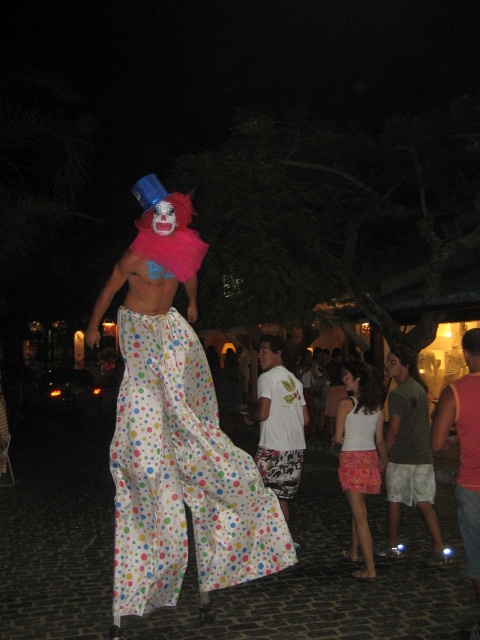
Question: Estimate the real-world distances between objects in this image. Which object is farther from the white printed t-shirt at center?

Choices:
 (A) white polka dot pants at center
 (B) pink fabric skirt at lower center
 (C) white tank top at center
 (D) polka dot fabric pants at center

Answer: (A)

Question: Does polka dot fabric pants at center come in front of white printed t-shirt at center?

Choices:
 (A) yes
 (B) no

Answer: (A)

Question: Can you confirm if white tank top at center is positioned above white polka dot pants at center?

Choices:
 (A) yes
 (B) no

Answer: (B)

Question: Which point is closer to the camera?

Choices:
 (A) white printed t-shirt at center
 (B) pink fabric skirt at lower center
 (C) dark gray t-shirt at center
 (D) polka dot fabric pants at center

Answer: (D)

Question: Which point is closer to the camera taking this photo?

Choices:
 (A) (402, 452)
 (B) (369, 467)

Answer: (B)

Question: Does dark gray t-shirt at center have a larger size compared to white printed t-shirt at center?

Choices:
 (A) yes
 (B) no

Answer: (B)